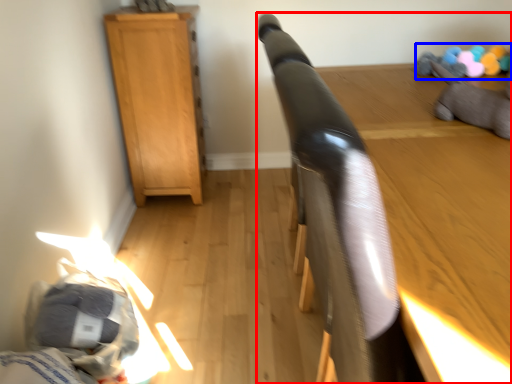
Question: Which object appears farthest to the camera in this image, furniture (highlighted by a red box) or toy (highlighted by a blue box)?

Choices:
 (A) furniture
 (B) toy

Answer: (B)